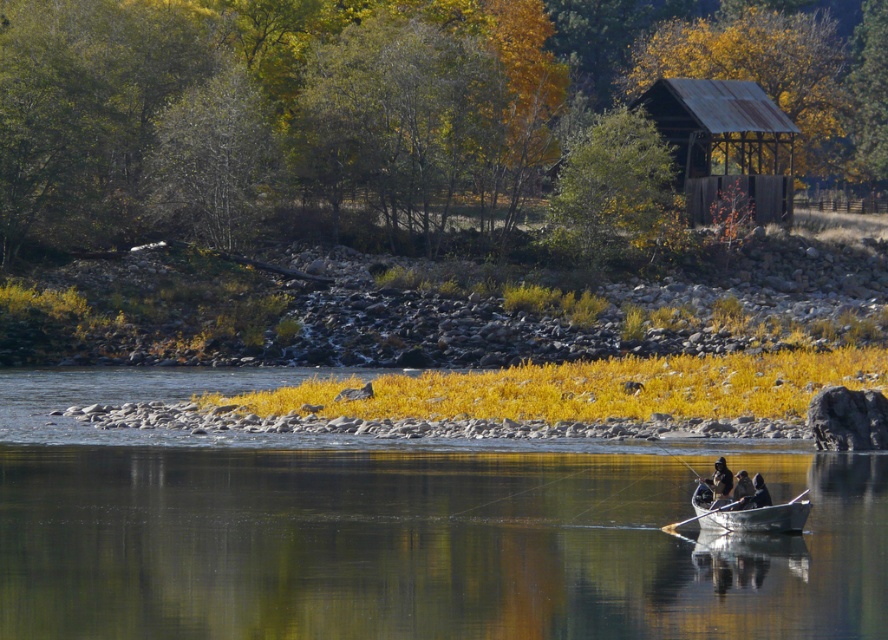
You are standing at the riverside and want to place a small flag at both point (712,180) and point (720,528). Which point is closer to you?

Point (712,180) is further to the viewer than point (720,528), so the closer point to you is point (720,528).

Based on the photo, you are a photographer planning to take a photo of the clear water at center and the rusty metal hut at upper right. Based on their positions, which object should you focus on first to ensure both are in frame?

The rusty metal hut at upper right should be focused on first since it is above the clear water at center, so adjusting the camera angle to include both would require starting with the higher object.